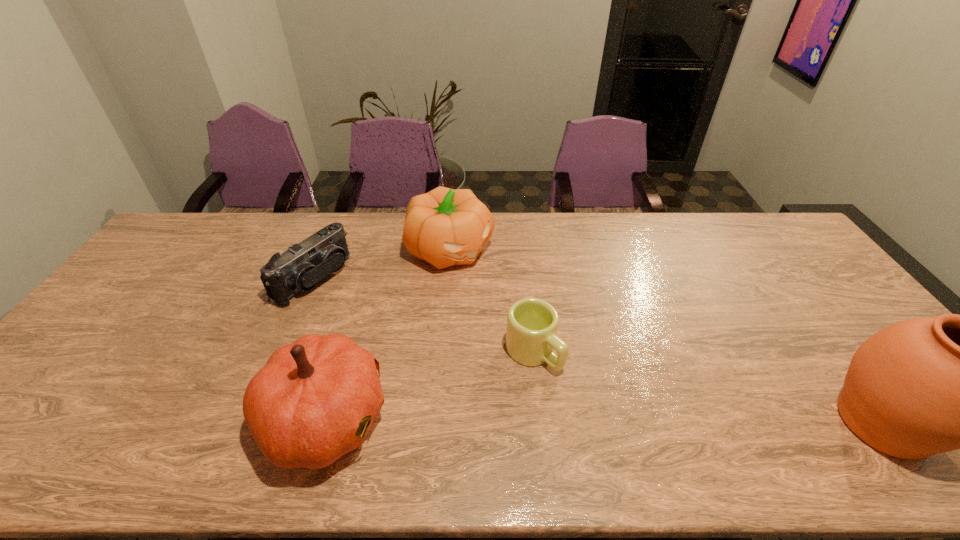
Where is `object that is the closest to the third shortest object`? This screenshot has width=960, height=540. object that is the closest to the third shortest object is located at coordinates (300, 268).

Point out which object is positioned as the fourth nearest to the urn. Please provide its 2D coordinates. Your answer should be formatted as a tuple, i.e. [(x, y)], where the tuple contains the x and y coordinates of a point satisfying the conditions above.

[(300, 268)]

Where is `vacant space that satisfies the following two spatial constraints: 1. on the back side of the camcorder; 2. on the left side of the shorter pumpkin`? vacant space that satisfies the following two spatial constraints: 1. on the back side of the camcorder; 2. on the left side of the shorter pumpkin is located at coordinates (325, 249).

Locate an element on the screen. This screenshot has width=960, height=540. free space that satisfies the following two spatial constraints: 1. on the front side of the camcorder; 2. on the front-facing side of the nearer pumpkin is located at coordinates (254, 418).

Where is `free space that satisfies the following two spatial constraints: 1. on the front side of the mug; 2. on the right side of the shorter pumpkin`? free space that satisfies the following two spatial constraints: 1. on the front side of the mug; 2. on the right side of the shorter pumpkin is located at coordinates [x=443, y=353].